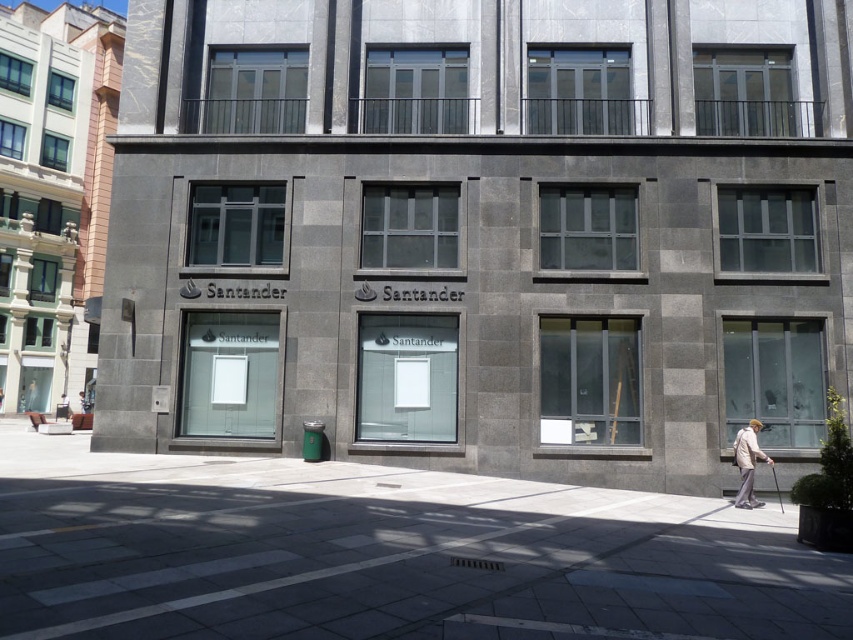
Does point (57, 410) come in front of point (86, 406)?

That is True.

Based on the photo, is brown leather bag at lower left to the left of white fabric at center from the viewer's perspective?

In fact, brown leather bag at lower left is to the right of white fabric at center.

Is point (65, 403) more distant than point (80, 394)?

No.

Image resolution: width=853 pixels, height=640 pixels. Find the location of `brown leather bag at lower left`. brown leather bag at lower left is located at coordinates (62, 406).

Is point (579, 611) closer to camera compared to point (738, 433)?

Yes, it is in front of point (738, 433).

Who is shorter, gray concrete pavement at center or light beige fabric coat at lower right?

light beige fabric coat at lower right is shorter.

Is point (399, 509) less distant than point (753, 436)?

That is True.

You are a GUI agent. You are given a task and a screenshot of the screen. Output one action in this format:
    pyautogui.click(x=<x>, y=<y>)
    Task: Click on the gray concrete pavement at center
    The width and height of the screenshot is (853, 640).
    Given the screenshot: What is the action you would take?
    pyautogui.click(x=384, y=554)

Can you confirm if gray concrete pavement at center is thinner than white fabric at center?

Incorrect, gray concrete pavement at center's width is not less than white fabric at center's.

Can you confirm if gray concrete pavement at center is smaller than white fabric at center?

No, gray concrete pavement at center is not smaller than white fabric at center.

Is point (33, 504) positioned after point (80, 401)?

No, it is in front of (80, 401).

Locate an element on the screen. gray concrete pavement at center is located at coordinates (384, 554).